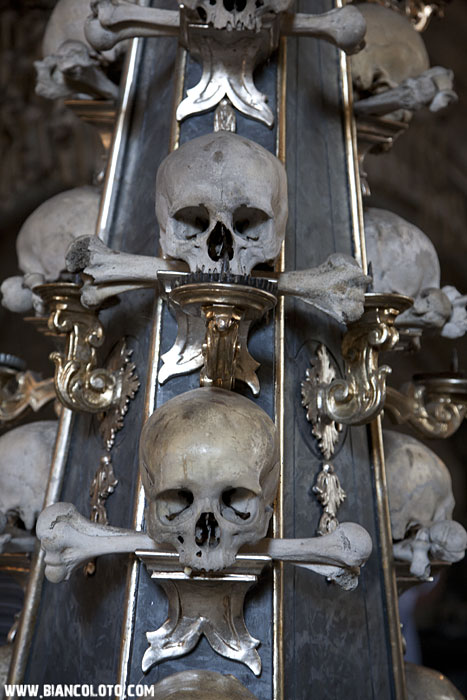
Identify the location of bracket. (71, 344), (222, 344), (364, 374), (445, 407).